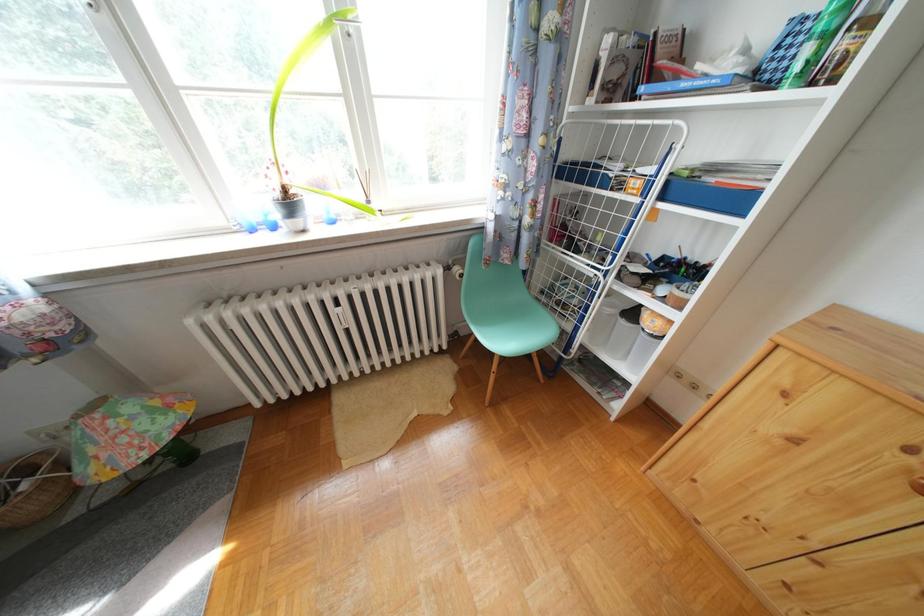
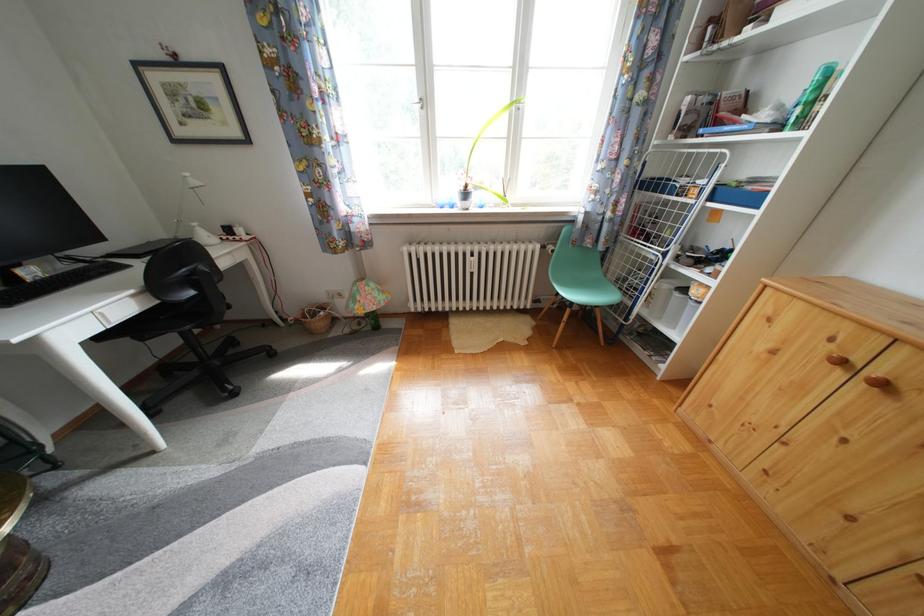
Question: The images are taken continuously from a first-person perspective. In which direction are you moving?

Choices:
 (A) Left
 (B) Right
 (C) Forward
 (D) Backward

Answer: (D)